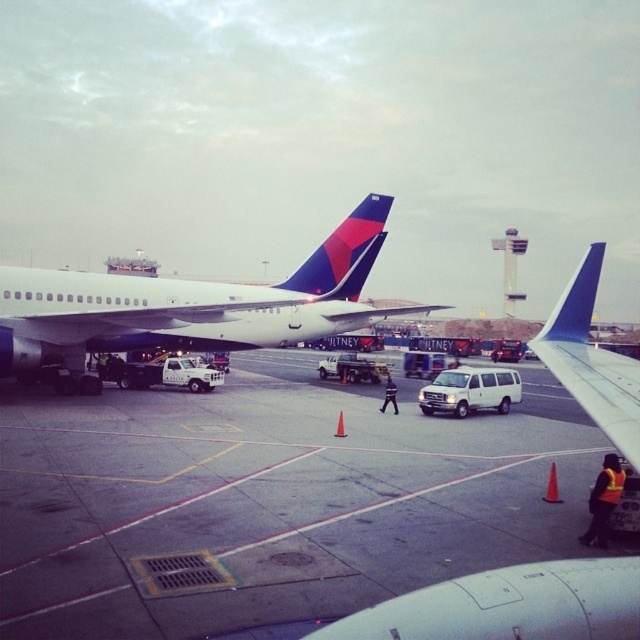
Is white glossy airplane at center smaller than white matte van at center?

No.

Does point (67, 296) come in front of point (445, 403)?

No, it is not.

Who is more distant from viewer, (376, 244) or (492, 396)?

Point (376, 244)

Identify the location of white glossy airplane at center. (189, 305).

Is point (627, 442) positioned after point (500, 412)?

No, (627, 442) is in front of (500, 412).

Which is behind, point (580, 260) or point (432, 406)?

Positioned behind is point (580, 260).

Where is `blue painted wing at right`? blue painted wing at right is located at coordinates (592, 360).

Does white glossy airplane at center appear on the left side of blue painted wing at right?

Incorrect, white glossy airplane at center is not on the left side of blue painted wing at right.

Image resolution: width=640 pixels, height=640 pixels. What do you see at coordinates (189, 305) in the screenshot?
I see `white glossy airplane at center` at bounding box center [189, 305].

I want to click on white glossy airplane at center, so click(189, 305).

At what (x,y) coordinates should I click in order to perform the action: click on white glossy airplane at center. Please return your answer as a coordinate pair (x, y). Looking at the image, I should click on (189, 305).